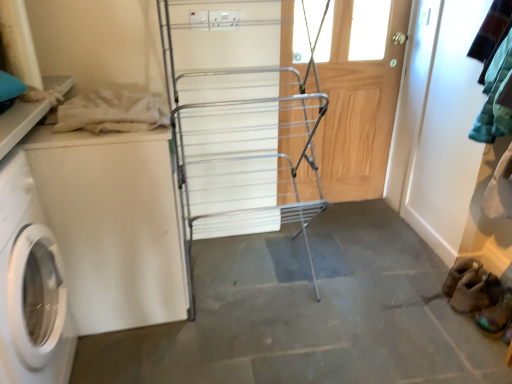
Question: From a real-world perspective, relative to brown suede shoe at lower right, which ranks as the second shoe in back-to-front order, is gray concrete floor at center vertically above or below?

Choices:
 (A) above
 (B) below

Answer: (B)

Question: Do you think gray concrete floor at center is within brown suede shoe at lower right, which ranks as the second shoe in back-to-front order, or outside of it?

Choices:
 (A) outside
 (B) inside

Answer: (A)

Question: Which is nearer to the gray concrete floor at center?

Choices:
 (A) brown suede shoe at lower right, arranged as the first shoe when viewed from the back
 (B) wooden screen door at center
 (C) beige cotton cloth at upper left
 (D) brown suede shoe at lower right, the 1th shoe in the front-to-back sequence
 (E) white matte washing machine at left, which is counted as the 2th washing machine, starting from the right

Answer: (A)

Question: Estimate the real-world distances between objects in this image. Which object is farther from the white matte washing machine at left, which is the second washing machine from left to right?

Choices:
 (A) wooden screen door at center
 (B) brown suede shoe at lower right, the 1th shoe in the front-to-back sequence
 (C) white matte washing machine at left, placed as the first washing machine when sorted from left to right
 (D) brown suede shoe at lower right, the second shoe positioned from the front
 (E) silver metallic drying rack at center

Answer: (B)